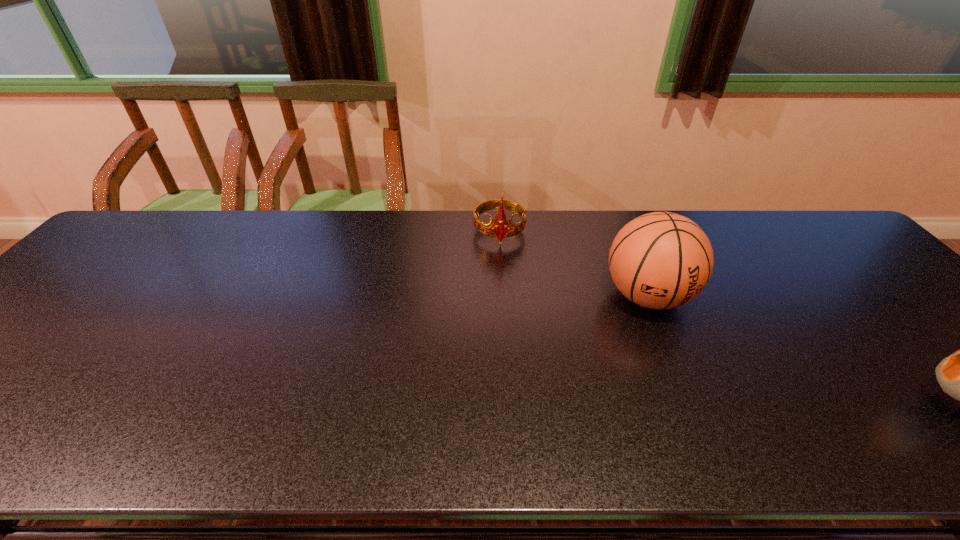
Image resolution: width=960 pixels, height=540 pixels. In the image, there is a desktop. What are the coordinates of `vacant space at the far right corner` in the screenshot? It's located at (814, 214).

Locate an element on the screen. The image size is (960, 540). free space between the farthest object and the tallest object is located at coordinates (573, 264).

The height and width of the screenshot is (540, 960). Identify the location of vacant space in between the tallest object and the tiara. (573, 264).

Identify the location of the closest object to the nearest object. (661, 260).

Point out which object is positioned as the second nearest to the tallest object. Please provide its 2D coordinates. Your answer should be formatted as a tuple, i.e. [(x, y)], where the tuple contains the x and y coordinates of a point satisfying the conditions above.

[(959, 375)]